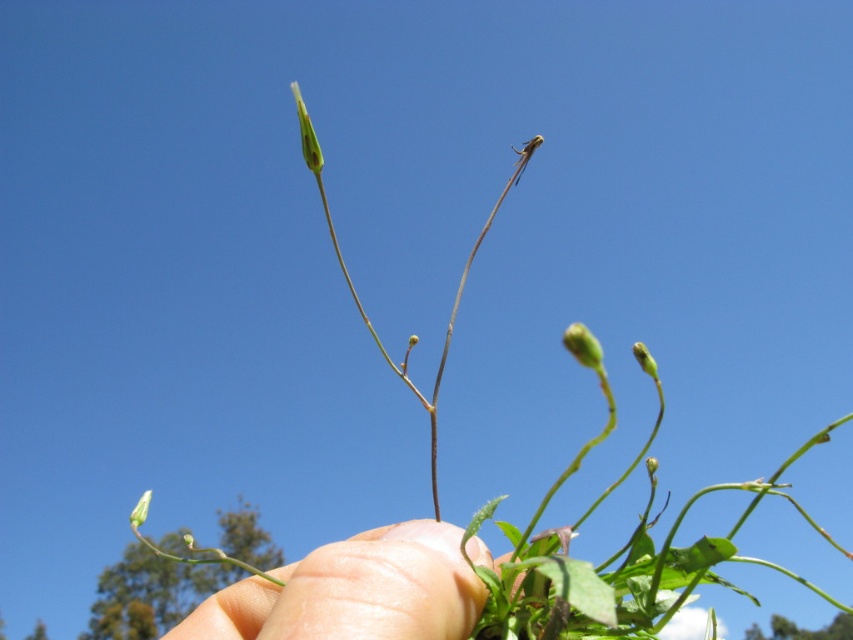
Question: Considering the real-world distances, which object is farthest from the green matte bud at upper center?

Choices:
 (A) green matte flower at lower left
 (B) green matte flower at upper center

Answer: (A)

Question: Which point is closer to the camera taking this photo?

Choices:
 (A) (573, 353)
 (B) (633, 353)
 (C) (302, 147)

Answer: (A)

Question: Is green matte bud at upper center above green matte flower at lower left?

Choices:
 (A) no
 (B) yes

Answer: (B)

Question: Which point is farther to the camera?

Choices:
 (A) green matte bud at center
 (B) green matte flower at upper center

Answer: (B)

Question: Is green matte bud at center bigger than green matte bud at upper center?

Choices:
 (A) yes
 (B) no

Answer: (B)

Question: Is green matte flower at upper center thinner than green matte flower at lower left?

Choices:
 (A) no
 (B) yes

Answer: (A)